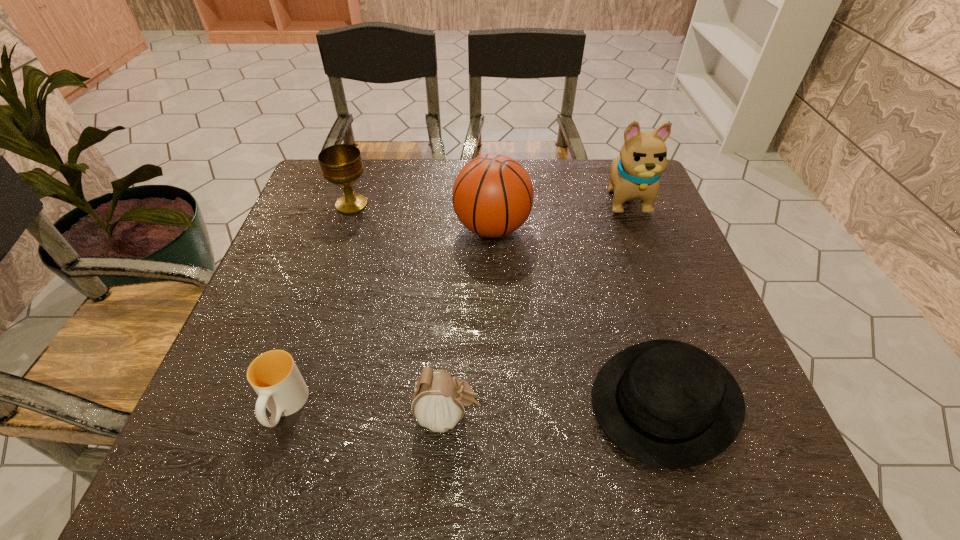
Image resolution: width=960 pixels, height=540 pixels. Find the location of `the tallest object`. the tallest object is located at coordinates (635, 173).

Find the location of a particular element. This screenshot has width=960, height=540. the second tallest object is located at coordinates (492, 196).

The image size is (960, 540). In order to click on chalice in this screenshot , I will do `click(341, 164)`.

I want to click on pouch, so click(439, 401).

The height and width of the screenshot is (540, 960). Identify the location of cup. (274, 376).

I want to click on fedora, so click(x=668, y=404).

Locate an element on the screen. The image size is (960, 540). free space located 0.070m on the face of the tallest object is located at coordinates (642, 239).

Image resolution: width=960 pixels, height=540 pixels. Identify the location of blank area located 0.380m on the front of the basketball. (497, 400).

This screenshot has height=540, width=960. In order to click on vacant space located 0.160m on the front of the third tallest object in this screenshot , I will do `click(333, 259)`.

At what (x,y) coordinates should I click in order to perform the action: click on vacant area situated 0.140m on the front-facing side of the third shortest object. Please return your answer as a coordinate pair (x, y). This screenshot has height=540, width=960. Looking at the image, I should click on (562, 415).